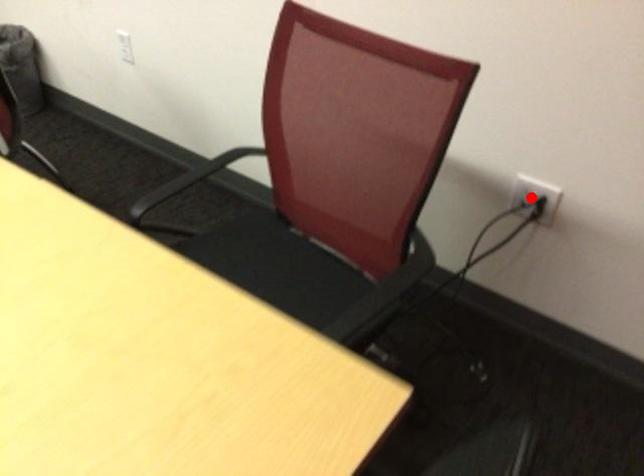
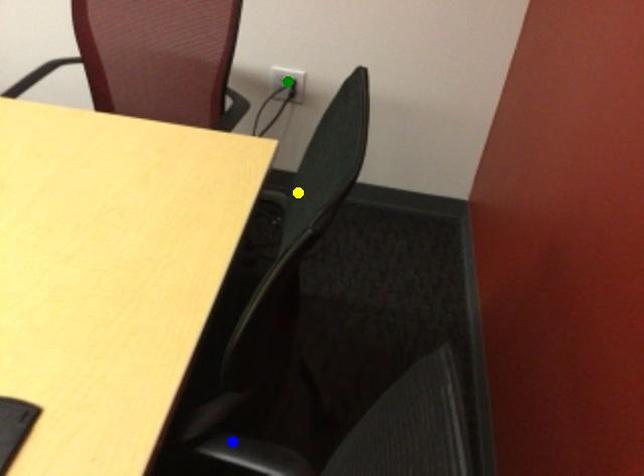
Question: I am providing you with two images of the same scene from different viewpoints. A red point is marked on the first image. You are given multiple points on the second image. Which mark in image 2 goes with the point in image 1?

Choices:
 (A) yellow point
 (B) green point
 (C) blue point

Answer: (B)